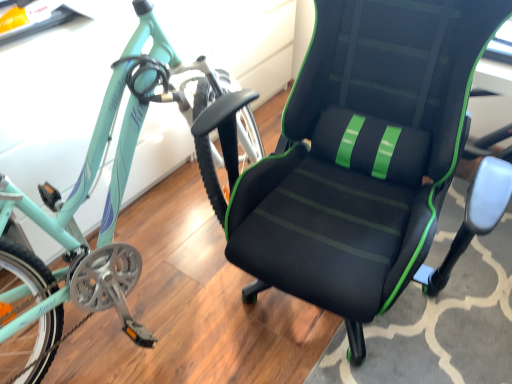
Question: Would you say black mesh chair at center is inside or outside teal matte bicycle at left?

Choices:
 (A) inside
 (B) outside

Answer: (B)

Question: Considering the positions of black mesh chair at center and teal matte bicycle at left in the image, is black mesh chair at center taller or shorter than teal matte bicycle at left?

Choices:
 (A) tall
 (B) short

Answer: (A)

Question: From the image's perspective, is black mesh chair at center located above or below teal matte bicycle at left?

Choices:
 (A) above
 (B) below

Answer: (B)

Question: Considering their positions, is teal matte bicycle at left located in front of or behind black mesh chair at center?

Choices:
 (A) behind
 (B) front

Answer: (B)

Question: Looking at their shapes, would you say teal matte bicycle at left is wider or thinner than black mesh chair at center?

Choices:
 (A) wide
 (B) thin

Answer: (B)

Question: Looking at the image, does teal matte bicycle at left seem bigger or smaller compared to black mesh chair at center?

Choices:
 (A) big
 (B) small

Answer: (A)

Question: From their relative heights in the image, would you say teal matte bicycle at left is taller or shorter than black mesh chair at center?

Choices:
 (A) short
 (B) tall

Answer: (A)